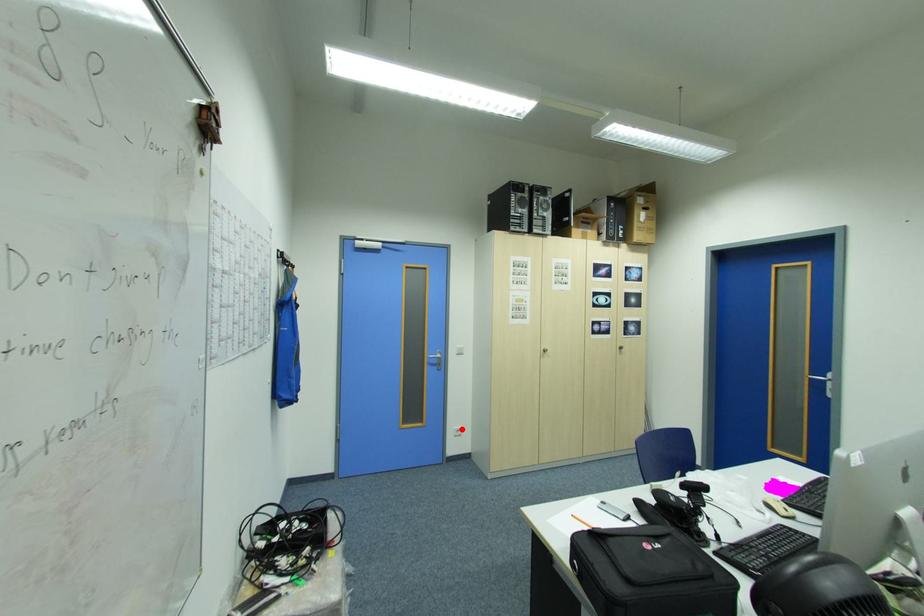
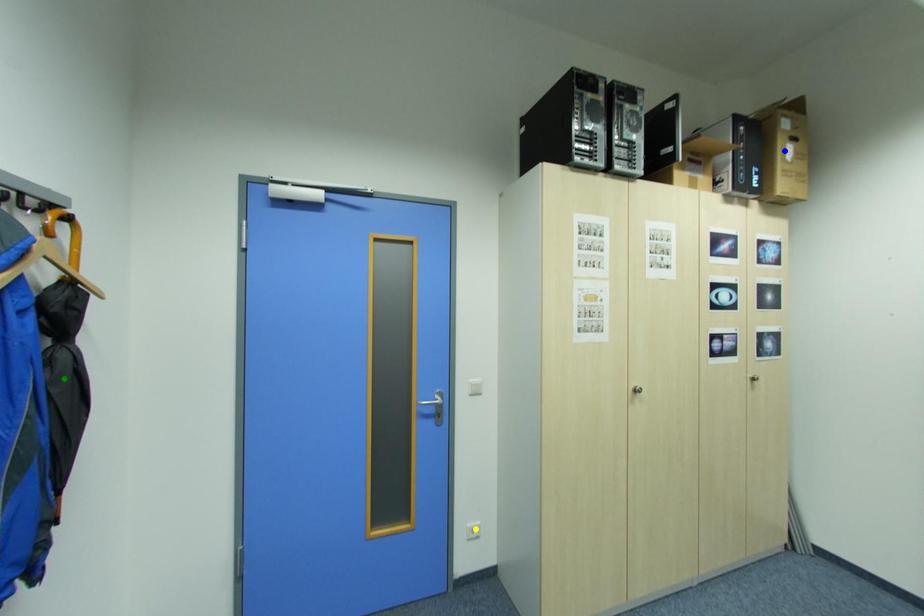
Question: I am providing you with two images of the same scene from different viewpoints. A red point is marked on the first image. You are given multiple points on the second image. Which point in image 2 represents the same 3d spot as the red point in image 1?

Choices:
 (A) yellow point
 (B) blue point
 (C) green point

Answer: (A)